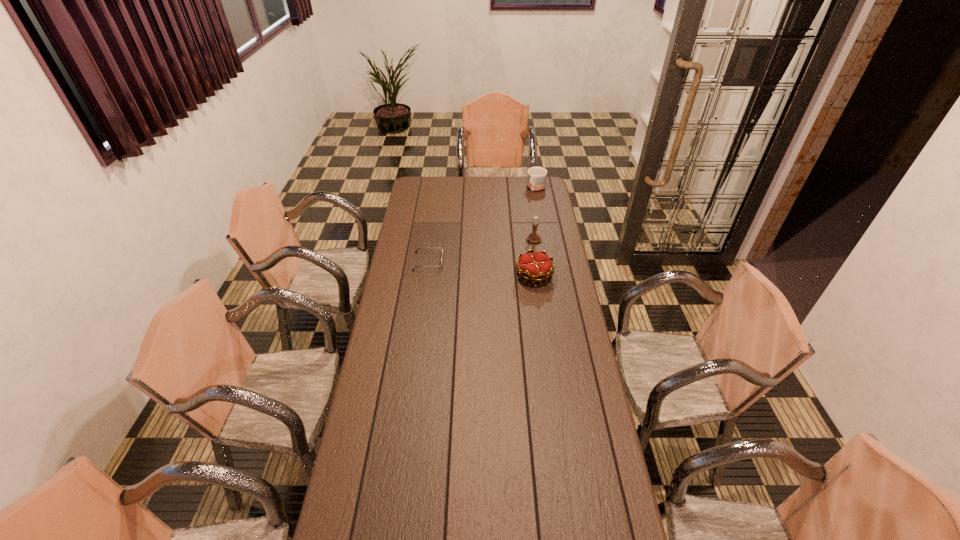
This screenshot has height=540, width=960. I want to click on free space on the desktop that is between the leftmost object and the crown and is positioned on the side of the tallest object with the handle, so click(x=473, y=268).

Find the location of a particular element. free space on the desktop that is between the shortest object and the crown and is positioned on the side with the handle of the farthest object is located at coordinates (471, 267).